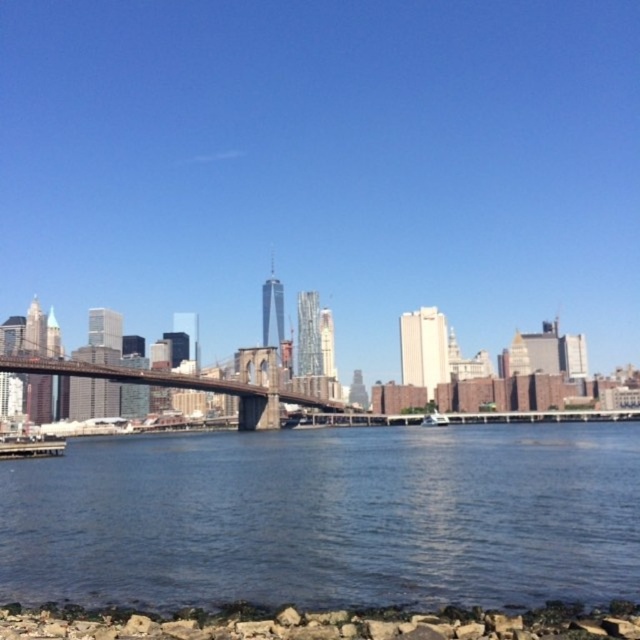
Can you confirm if rocks at lower center is shorter than brown wooden bridge at center?

Indeed, rocks at lower center has a lesser height compared to brown wooden bridge at center.

Does rocks at lower center have a greater width compared to brown wooden bridge at center?

Incorrect, rocks at lower center's width does not surpass brown wooden bridge at center's.

You are a GUI agent. You are given a task and a screenshot of the screen. Output one action in this format:
    pyautogui.click(x=<x>, y=<y>)
    Task: Click on the rocks at lower center
    Image resolution: width=640 pixels, height=640 pixels.
    Given the screenshot: What is the action you would take?
    pyautogui.click(x=320, y=621)

Is blue water at lower center positioned before brown wooden bridge at center?

Yes, it is in front of brown wooden bridge at center.

Which of these two, blue water at lower center or brown wooden bridge at center, stands taller?

Standing taller between the two is brown wooden bridge at center.

Does point (48, 570) come farther from viewer compared to point (157, 374)?

No, it is in front of (157, 374).

Where is `blue water at lower center`? The height and width of the screenshot is (640, 640). blue water at lower center is located at coordinates (328, 516).

Between blue water at lower center and rocks at lower center, which one appears on the left side from the viewer's perspective?

blue water at lower center

Is blue water at lower center closer to the viewer compared to rocks at lower center?

That is False.

Is point (440, 529) positioned before point (132, 611)?

No.

The height and width of the screenshot is (640, 640). I want to click on blue water at lower center, so click(x=328, y=516).